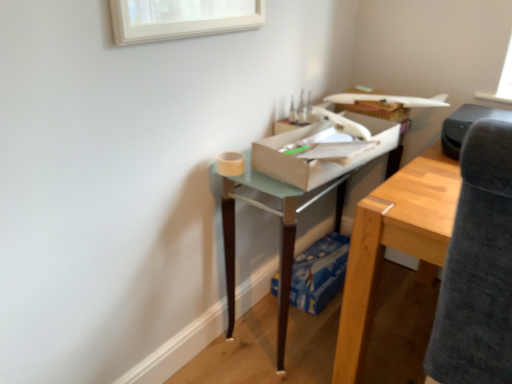
Question: From the image's perspective, is dark gray fabric swivel chair at right located above or below translucent glass table at center?

Choices:
 (A) above
 (B) below

Answer: (B)

Question: From a real-world perspective, relative to translucent glass table at center, is dark gray fabric swivel chair at right vertically above or below?

Choices:
 (A) above
 (B) below

Answer: (A)

Question: Which object is the closest to the dark gray fabric swivel chair at right?

Choices:
 (A) translucent glass table at center
 (B) blue cardboard box at lower center, the first cardboard box when ordered from bottom to top
 (C) black plastic printer at upper right
 (D) white cardboard box at center, acting as the 1th cardboard box starting from the front

Answer: (D)

Question: Which object is the farthest from the white cardboard box at center, which appears as the first cardboard box when viewed from the top?

Choices:
 (A) translucent glass table at center
 (B) black plastic printer at upper right
 (C) dark gray fabric swivel chair at right
 (D) blue cardboard box at lower center, the 1th cardboard box positioned from the back

Answer: (D)